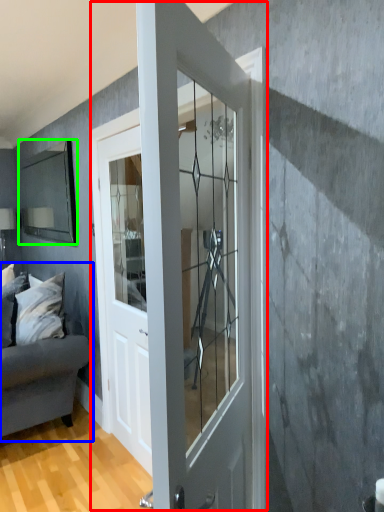
Question: Which is farther away from door (highlighted by a red box)? studio couch (highlighted by a blue box) or mirror (highlighted by a green box)?

Choices:
 (A) studio couch
 (B) mirror

Answer: (B)